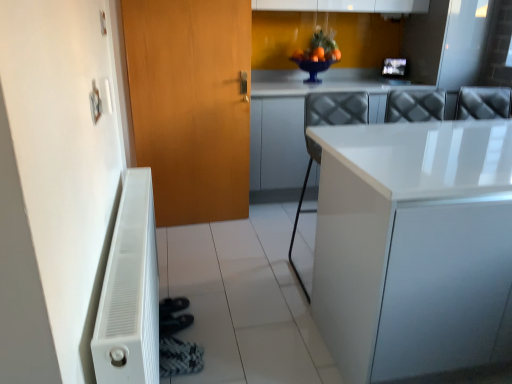
You are a GUI agent. You are given a task and a screenshot of the screen. Output one action in this format:
    pyautogui.click(x=<x>, y=<y>)
    Task: Click on the free location above white matte radiator at lower left (from a real-world perspective)
    This screenshot has height=384, width=512.
    Given the screenshot: What is the action you would take?
    pyautogui.click(x=123, y=229)